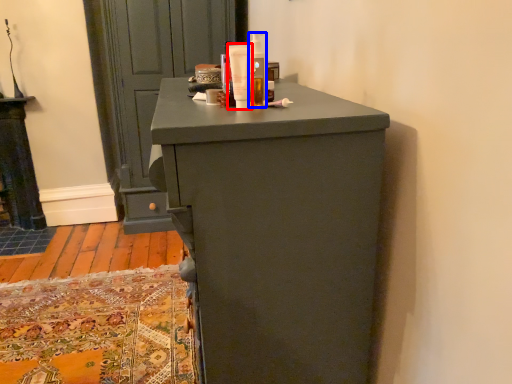
Question: Which object appears farthest to the camera in this image, toiletry (highlighted by a red box) or toiletry (highlighted by a blue box)?

Choices:
 (A) toiletry
 (B) toiletry

Answer: (B)